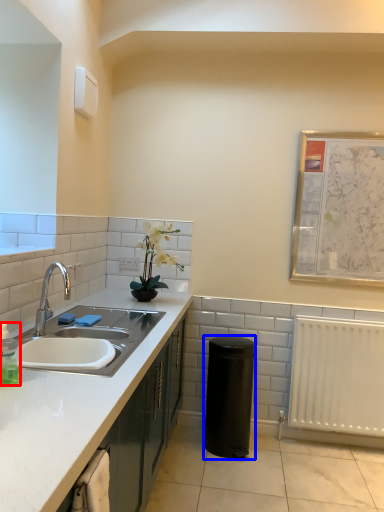
Question: Which point is closer to the camera, bottle (highlighted by a red box) or appliance (highlighted by a blue box)?

Choices:
 (A) bottle
 (B) appliance

Answer: (A)